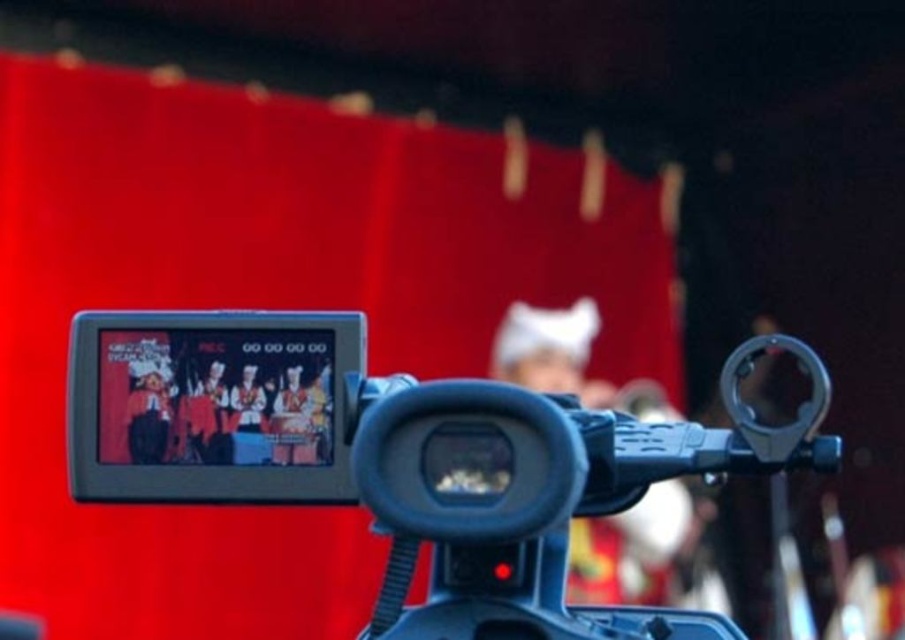
You are adjusting the focus of the video camera and need to ensure that both the point at coordinates point (511,557) and the point at coordinates point (319,396) are in focus. Given that the camera can only focus on objects at a single depth plane, which point should you prioritize focusing on to capture the most important subject?

You should prioritize focusing on point (511,557) because it is closer to the camera than point (319,396), making it the primary subject in the frame.

You are setting up a tripod to film an event. The black plastic video camera at center has a matte black screen at center. Which object should you adjust to ensure the screen is visible to the audience?

Since the black plastic video camera at center is much taller than the matte black screen at center, you should lower the camera or adjust its angle so the screen becomes visible to the audience.